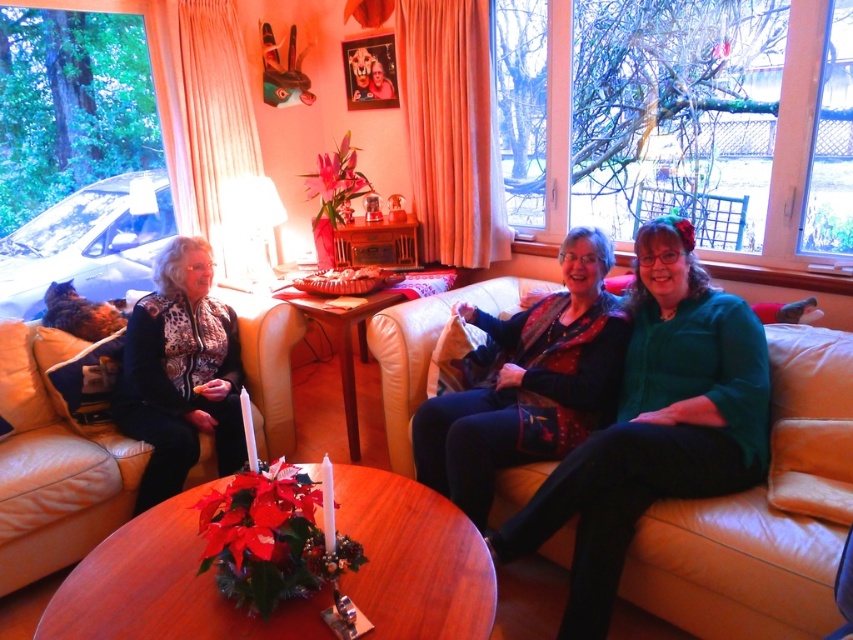
You are hosting a guest who wants to sit as close as possible to the fireplace. The leather couch at lower left and the velvet green sweater at center are both in the seating area. Which one is closer to the fireplace?

The velvet green sweater at center is closer to the fireplace because the leather couch at lower left is to the left of it, meaning the sweater is positioned between the couch and the fireplace.

You are a delivery person who needs to place a small package between the velvet green sweater at center and the patterned fabric jacket at left. Is there enough space to fit the package, which is 1 meter long?

The distance between the velvet green sweater at center and the patterned fabric jacket at left is exactly 1.00 meters, so the 1 meter long package can fit perfectly between them.

You are standing in the living room and want to pick up the velvet green sweater at center. According to the coordinates given, where exactly should you look to find it?

The velvet green sweater at center is located at the 2D coordinates point (527, 384).